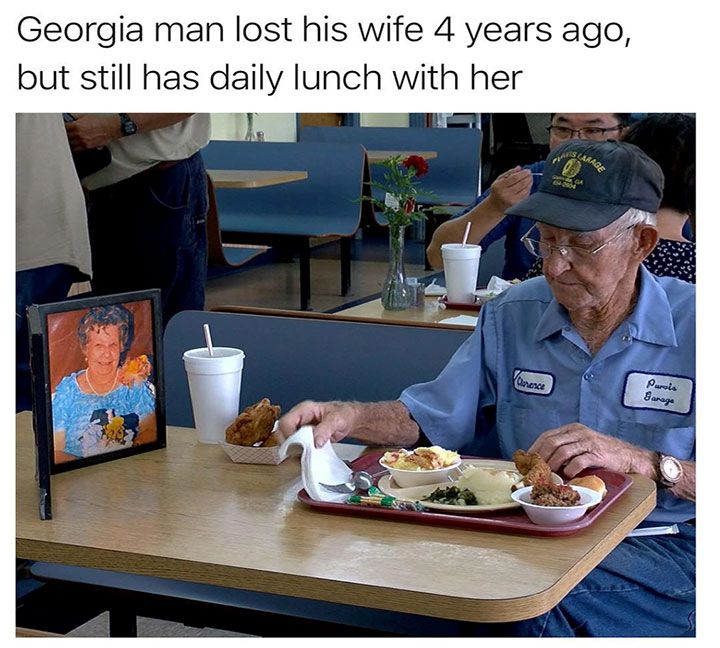
The height and width of the screenshot is (648, 720). Identify the location of "wood" table tan. (543, 577).